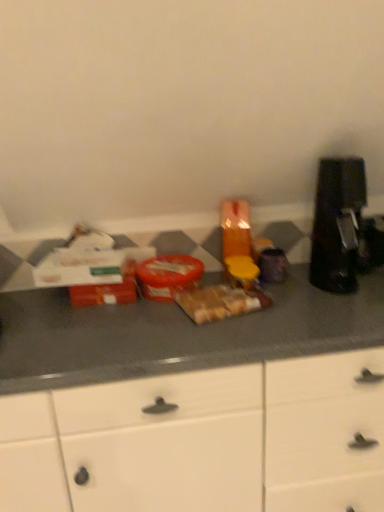
At what (x,y) coordinates should I click in order to perform the action: click on vacant area that is in front of matte plastic container at center, placed as the 1th food when sorted from left to right. Please return your answer as a coordinate pair (x, y). Looking at the image, I should click on (147, 313).